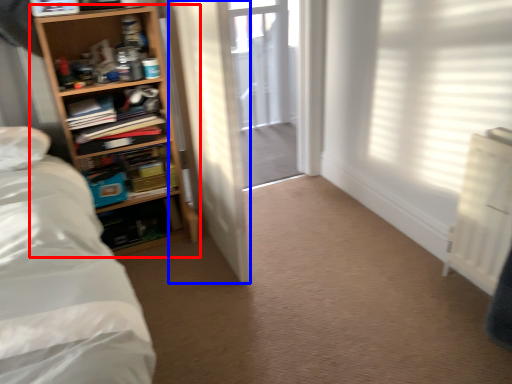
Question: Which object is closer to the camera taking this photo, shelf (highlighted by a red box) or door (highlighted by a blue box)?

Choices:
 (A) shelf
 (B) door

Answer: (B)